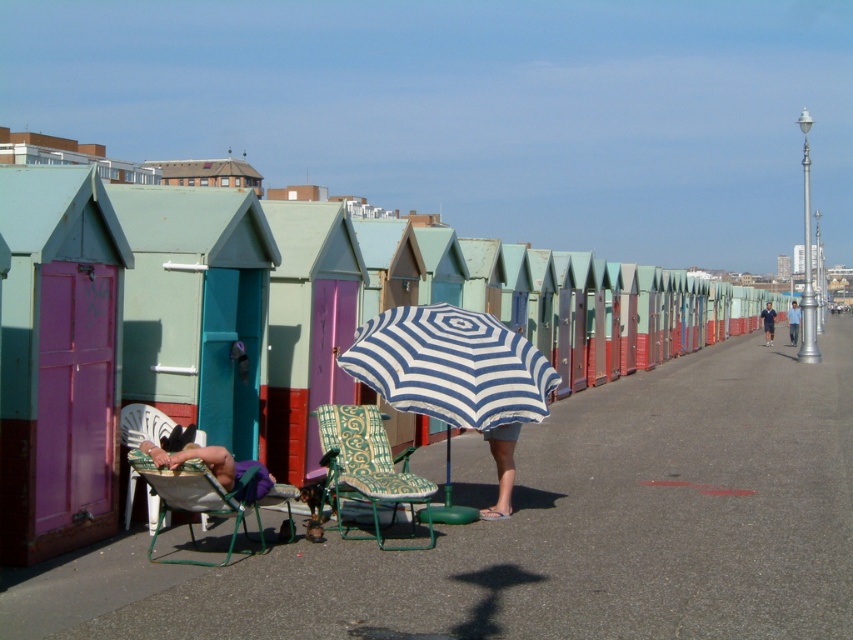
You are standing at the point marked as point (554, 531) in the image. What object is located exactly at this point?

The striped fabric umbrella at center is located exactly at point (554, 531).

You are a fashion designer observing the scene at the seaside promenade. You notice two outfits in the foreground. Which outfit is shorter in length between the matte green skirt at center and the dark blue jeans at far right?

The matte green skirt at center is shorter than the dark blue jeans at far right.